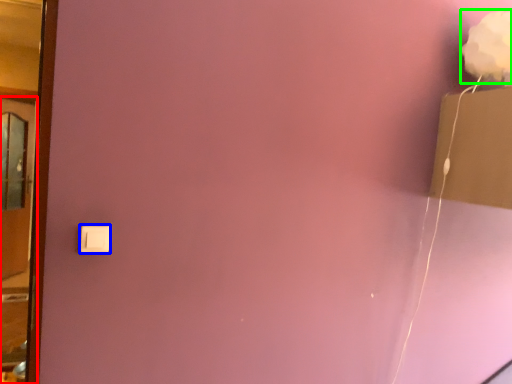
Question: Estimate the real-world distances between objects in this image. Which object is closer to door (highlighted by a red box), light switch (highlighted by a blue box) or flower (highlighted by a green box)?

Choices:
 (A) light switch
 (B) flower

Answer: (A)